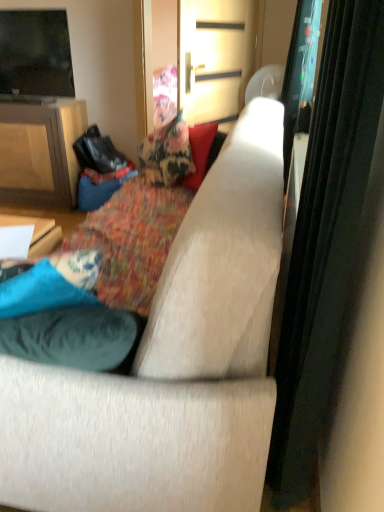
Question: Choose the correct answer: Is matte wood cabinet at left inside flat screen tv at upper left or outside it?

Choices:
 (A) outside
 (B) inside

Answer: (A)

Question: Considering the positions of matte wood cabinet at left and flat screen tv at upper left in the image, is matte wood cabinet at left taller or shorter than flat screen tv at upper left?

Choices:
 (A) short
 (B) tall

Answer: (B)

Question: Which object is positioned closest to the suede-like beige couch at center?

Choices:
 (A) flat screen tv at upper left
 (B) floral fabric cushion at center
 (C) matte wood cabinet at left
 (D) metallic gold door at upper center, the first screen door when ordered from left to right
 (E) transparent glass screen door at upper right, acting as the 1th screen door starting from the right

Answer: (B)

Question: Based on their relative distances, which object is farther from the matte wood cabinet at left?

Choices:
 (A) metallic gold door at upper center, arranged as the second screen door when viewed from the right
 (B) transparent glass screen door at upper right, the second screen door viewed from the left
 (C) floral fabric cushion at center
 (D) suede-like beige couch at center
 (E) flat screen tv at upper left

Answer: (D)